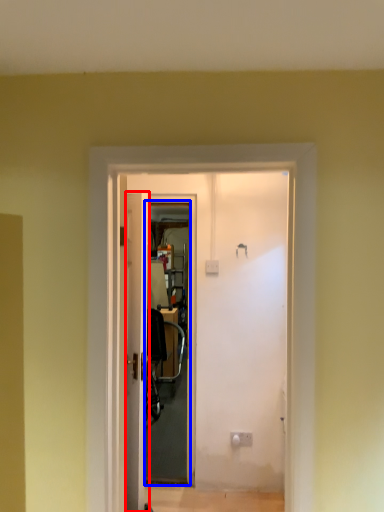
Question: Which object is closer to the camera taking this photo, door (highlighted by a red box) or screen door (highlighted by a blue box)?

Choices:
 (A) door
 (B) screen door

Answer: (A)